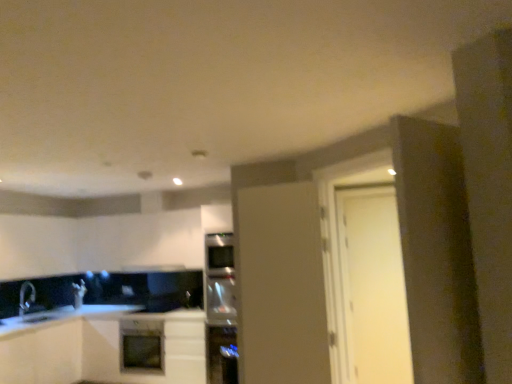
Locate an element on the screen. blank space above matte white door at center, acting as the first door starting from the left (from a real-world perspective) is located at coordinates (281, 185).